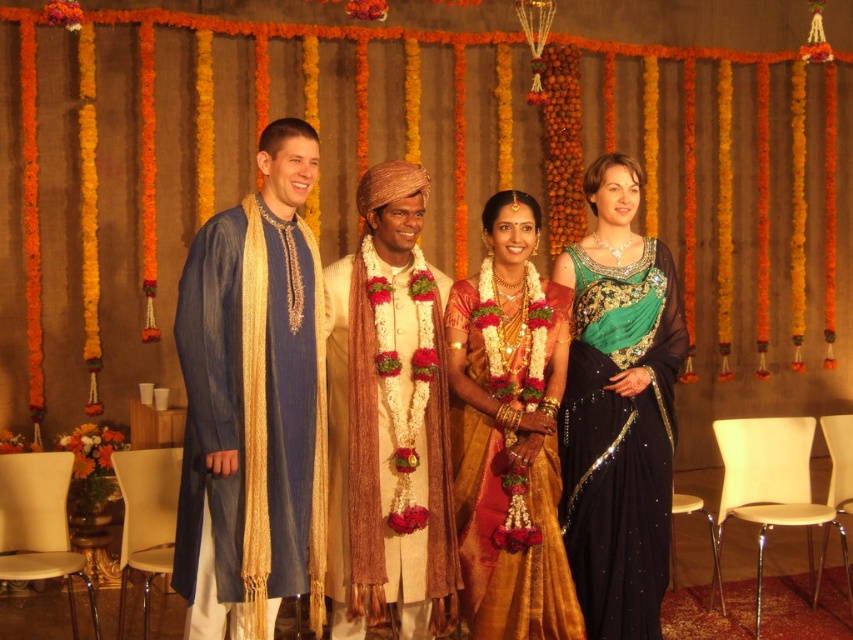
Which is behind, point (265, 196) or point (538, 502)?

The point (538, 502) is behind.

Who is higher up, blue silk kurta at left or gold silk saree at center?

blue silk kurta at left

This screenshot has width=853, height=640. What are the coordinates of `blue silk kurta at left` in the screenshot? It's located at (253, 403).

Image resolution: width=853 pixels, height=640 pixels. Identify the location of blue silk kurta at left. (253, 403).

Image resolution: width=853 pixels, height=640 pixels. Describe the element at coordinates (253, 403) in the screenshot. I see `blue silk kurta at left` at that location.

Is blue silk kurta at left further to the viewer compared to green sequined saree at right?

No, blue silk kurta at left is in front of green sequined saree at right.

Find the location of `blue silk kurta at left`. blue silk kurta at left is located at coordinates (253, 403).

Who is taller, green sequined saree at right or gold silk saree at center?

green sequined saree at right is taller.

Does green sequined saree at right appear under gold silk saree at center?

No, green sequined saree at right is not below gold silk saree at center.

Describe the element at coordinates (618, 410) in the screenshot. The height and width of the screenshot is (640, 853). I see `green sequined saree at right` at that location.

Identify the location of green sequined saree at right. The height and width of the screenshot is (640, 853). (618, 410).